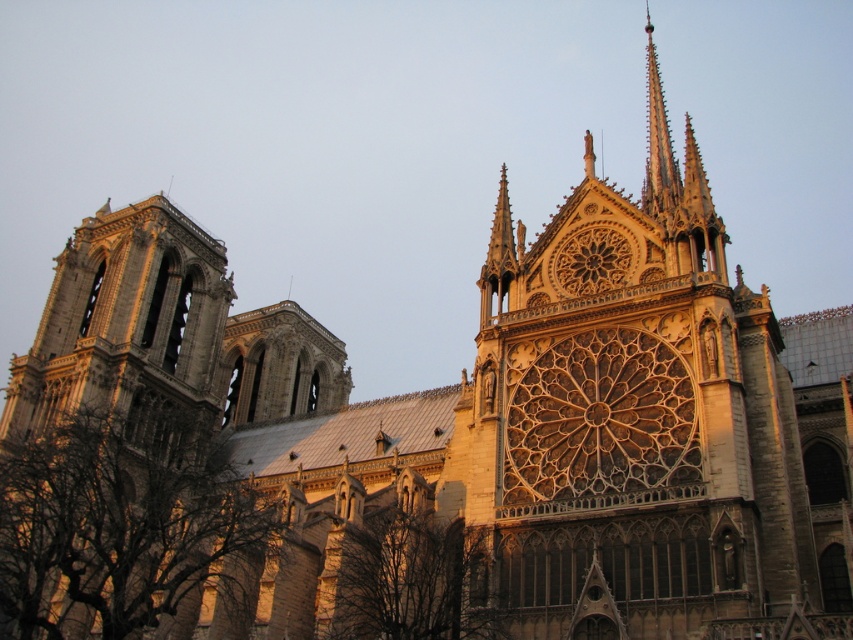
Question: In this image, where is brown leafless branches at lower left located relative to stone tower at left?

Choices:
 (A) right
 (B) left

Answer: (A)

Question: Is stone tower at left positioned in front of brown leafless tree at lower center?

Choices:
 (A) yes
 (B) no

Answer: (B)

Question: Estimate the real-world distances between objects in this image. Which object is farther from the stone tower at left?

Choices:
 (A) brown leafless tree at lower center
 (B) golden stone spire at upper right
 (C) brown leafless branches at lower left

Answer: (B)

Question: Which object is farther from the camera taking this photo?

Choices:
 (A) stone tower at left
 (B) golden stone spire at upper right
 (C) brown leafless branches at lower left

Answer: (A)

Question: Among these objects, which one is nearest to the camera?

Choices:
 (A) golden stone spire at upper right
 (B) brown leafless tree at lower center

Answer: (B)

Question: Is brown leafless branches at lower left to the right of golden stone spire at upper right from the viewer's perspective?

Choices:
 (A) yes
 (B) no

Answer: (B)